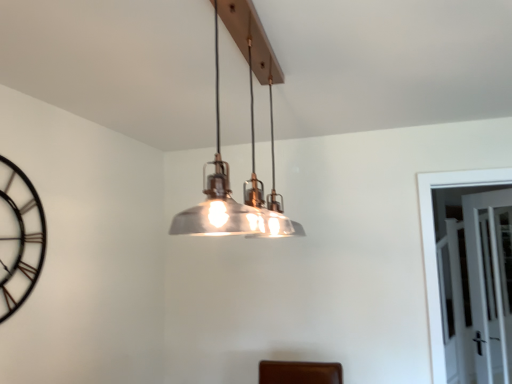
Question: Are black metal clock at left and metallic/textured pendant light at center far apart?

Choices:
 (A) no
 (B) yes

Answer: (B)

Question: Considering the relative sizes of black metal clock at left and metallic/textured pendant light at center in the image provided, is black metal clock at left shorter than metallic/textured pendant light at center?

Choices:
 (A) yes
 (B) no

Answer: (B)

Question: Can you confirm if black metal clock at left is smaller than metallic/textured pendant light at center?

Choices:
 (A) yes
 (B) no

Answer: (A)

Question: From a real-world perspective, is black metal clock at left beneath metallic/textured pendant light at center?

Choices:
 (A) yes
 (B) no

Answer: (A)

Question: Is black metal clock at left to the right of metallic/textured pendant light at center from the viewer's perspective?

Choices:
 (A) yes
 (B) no

Answer: (B)

Question: From their relative heights in the image, would you say clear glass door at right is taller or shorter than black metal clock at left?

Choices:
 (A) tall
 (B) short

Answer: (A)

Question: Looking at their shapes, would you say clear glass door at right is wider or thinner than black metal clock at left?

Choices:
 (A) wide
 (B) thin

Answer: (A)

Question: Considering their positions, is clear glass door at right located in front of or behind black metal clock at left?

Choices:
 (A) front
 (B) behind

Answer: (B)

Question: Which is correct: clear glass door at right is inside black metal clock at left, or outside of it?

Choices:
 (A) outside
 (B) inside

Answer: (A)

Question: In the image, is metallic/textured pendant light at center positioned in front of or behind black metal clock at left?

Choices:
 (A) behind
 (B) front

Answer: (B)

Question: From the image's perspective, is metallic/textured pendant light at center positioned above or below black metal clock at left?

Choices:
 (A) above
 (B) below

Answer: (A)

Question: Considering the positions of metallic/textured pendant light at center and black metal clock at left in the image, is metallic/textured pendant light at center taller or shorter than black metal clock at left?

Choices:
 (A) short
 (B) tall

Answer: (A)

Question: From a real-world perspective, relative to black metal clock at left, is metallic/textured pendant light at center vertically above or below?

Choices:
 (A) below
 (B) above

Answer: (B)

Question: In terms of width, does clear glass door at right look wider or thinner when compared to metallic/textured pendant light at center?

Choices:
 (A) thin
 (B) wide

Answer: (A)

Question: Is clear glass door at right inside or outside of metallic/textured pendant light at center?

Choices:
 (A) outside
 (B) inside

Answer: (A)